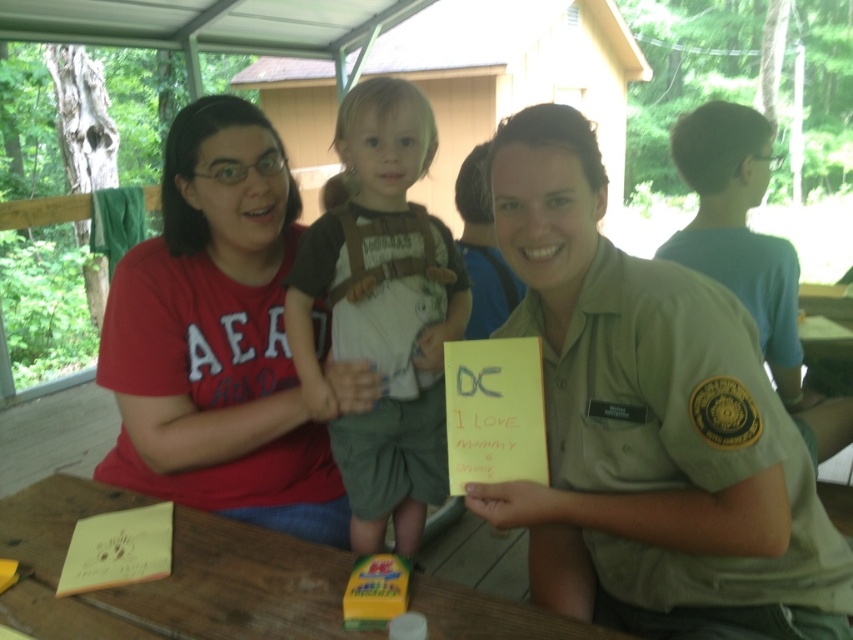
Where is `matte red t-shirt at left`? This screenshot has height=640, width=853. matte red t-shirt at left is located at coordinates (218, 339).

Does matte red t-shirt at left have a lesser width compared to wooden table at lower center?

Correct, matte red t-shirt at left's width is less than wooden table at lower center's.

Where is `matte red t-shirt at left`? The height and width of the screenshot is (640, 853). matte red t-shirt at left is located at coordinates (218, 339).

You are a GUI agent. You are given a task and a screenshot of the screen. Output one action in this format:
    pyautogui.click(x=<x>, y=<y>)
    Task: Click on the matte red t-shirt at left
    Image resolution: width=853 pixels, height=640 pixels.
    Given the screenshot: What is the action you would take?
    pyautogui.click(x=218, y=339)

Does brown cotton shirt at center appear on the left side of wooden table at lower center?

In fact, brown cotton shirt at center is to the right of wooden table at lower center.

Is brown cotton shirt at center to the right of wooden table at lower center from the viewer's perspective?

Correct, you'll find brown cotton shirt at center to the right of wooden table at lower center.

Locate an element on the screen. This screenshot has height=640, width=853. brown cotton shirt at center is located at coordinates (381, 310).

Can you confirm if matte red t-shirt at left is thinner than brown cotton shirt at center?

No.

Can you confirm if matte red t-shirt at left is positioned below brown cotton shirt at center?

No, matte red t-shirt at left is not below brown cotton shirt at center.

Find the location of a particular element. matte red t-shirt at left is located at coordinates (218, 339).

Where is `matte red t-shirt at left`? matte red t-shirt at left is located at coordinates (218, 339).